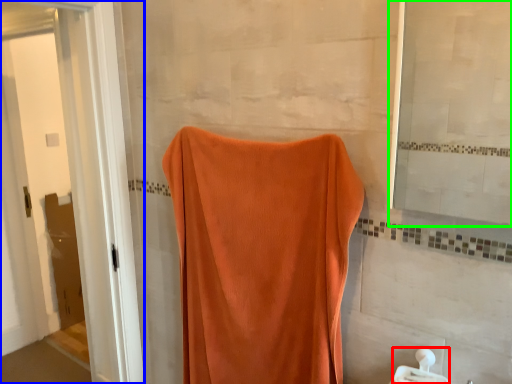
Question: Which object is positioned farthest from towel bar (highlighted by a red box)? Select from screen door (highlighted by a blue box) and mirror (highlighted by a green box).

Choices:
 (A) screen door
 (B) mirror

Answer: (A)